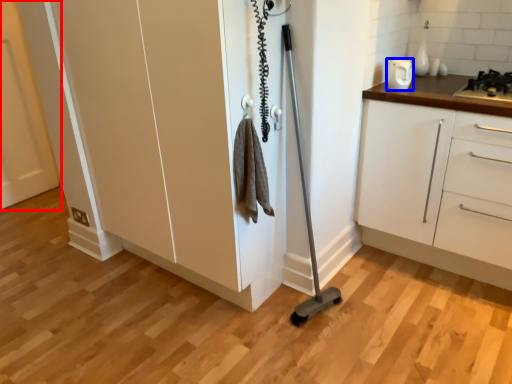
Question: Which object is closer to the camera taking this photo, door (highlighted by a red box) or appliance (highlighted by a blue box)?

Choices:
 (A) door
 (B) appliance

Answer: (B)